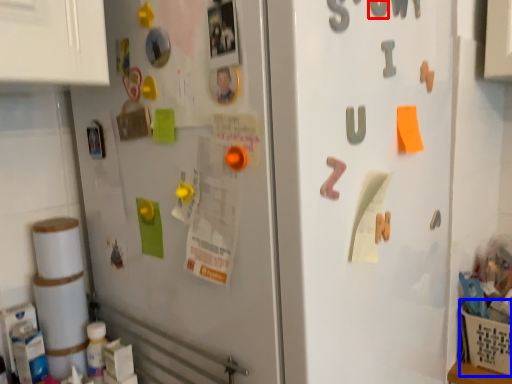
Question: Which point is closer to the camera, number (highlighted by a red box) or basket (highlighted by a blue box)?

Choices:
 (A) number
 (B) basket

Answer: (A)